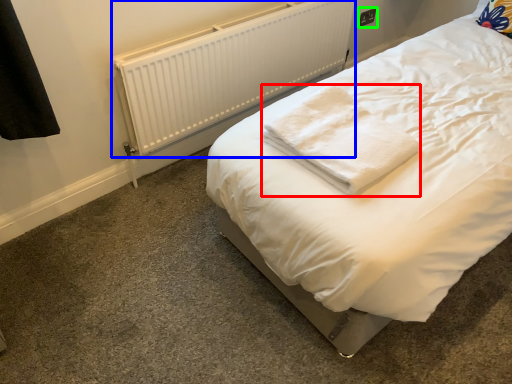
Question: Considering the real-world distances, which object is closest to cloth (highlighted by a red box)? radiator (highlighted by a blue box) or electric outlet (highlighted by a green box).

Choices:
 (A) radiator
 (B) electric outlet

Answer: (A)